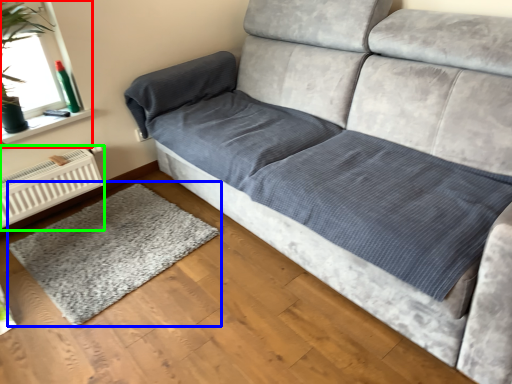
Question: Based on their relative distances, which object is farther from window screen (highlighted by a red box)? Choose from mat (highlighted by a blue box) and radiator (highlighted by a green box).

Choices:
 (A) mat
 (B) radiator

Answer: (A)